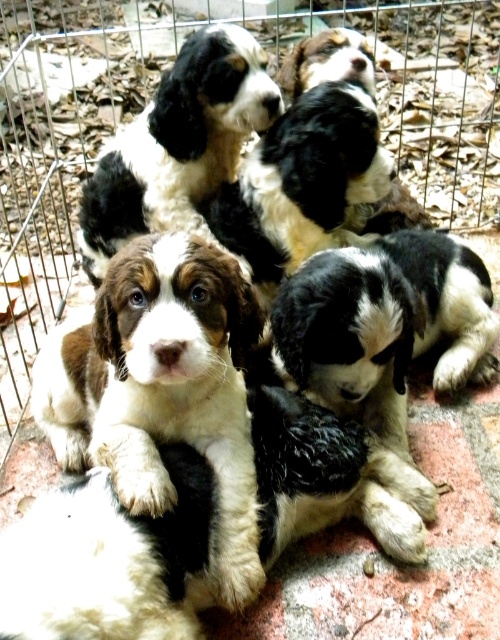
Which is behind, point (430, 40) or point (204, 417)?

Point (430, 40)

Image resolution: width=500 pixels, height=640 pixels. I want to click on metal wire fence at center, so click(147, 108).

The image size is (500, 640). Find the location of `metal wire fence at center`. metal wire fence at center is located at coordinates (147, 108).

Who is lower down, metal wire fence at center or black and white fur at center?

black and white fur at center is below.

Which is in front, point (8, 449) or point (156, 188)?

Point (8, 449) is in front.

What are the coordinates of `metal wire fence at center` in the screenshot? It's located at (147, 108).

Between point (185, 342) and point (127, 220), which one is positioned behind?

Point (127, 220)

What do you see at coordinates (161, 387) in the screenshot?
I see `soft fur puppy at center` at bounding box center [161, 387].

Which is behind, point (159, 404) or point (217, 177)?

Positioned behind is point (217, 177).

I want to click on soft fur puppy at center, so click(x=161, y=387).